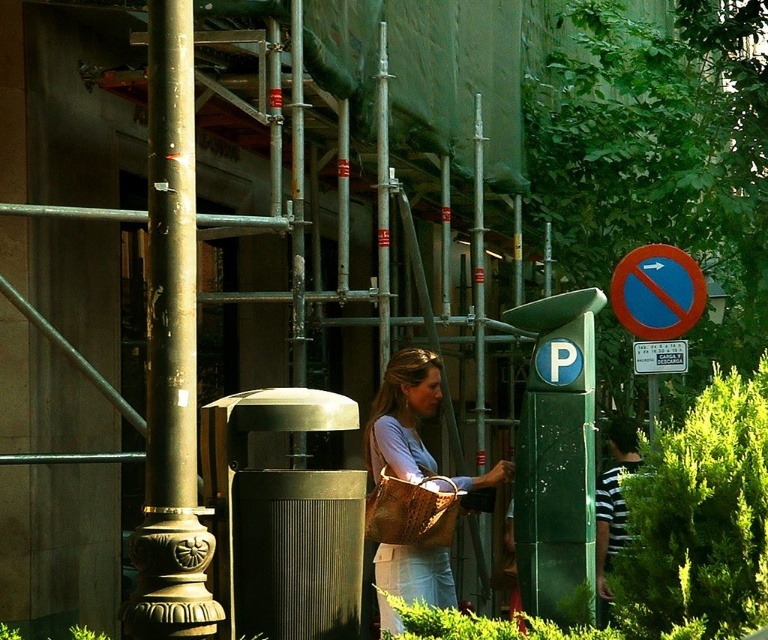
Question: Does red circular sign at upper right appear on the right side of striped fabric shirt at right?

Choices:
 (A) yes
 (B) no

Answer: (A)

Question: Is the position of green metallic parking meter at center-right more distant than that of striped fabric shirt at right?

Choices:
 (A) no
 (B) yes

Answer: (A)

Question: Is gold polished metal pole at left above striped fabric shirt at right?

Choices:
 (A) yes
 (B) no

Answer: (A)

Question: Which point is closer to the camera?

Choices:
 (A) (636, 461)
 (B) (639, 330)

Answer: (B)

Question: Among these points, which one is nearest to the camera?

Choices:
 (A) (608, 476)
 (B) (621, 285)
 (C) (389, 444)
 (D) (581, 513)

Answer: (D)

Question: Which point is closer to the camera?

Choices:
 (A) (382, 602)
 (B) (601, 484)

Answer: (A)